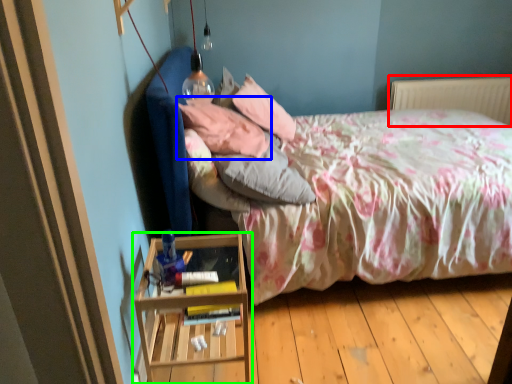
Question: Which object is the farthest from radiator (highlighted by a red box)? Choose among these: pillow (highlighted by a blue box) or nightstand (highlighted by a green box).

Choices:
 (A) pillow
 (B) nightstand

Answer: (B)